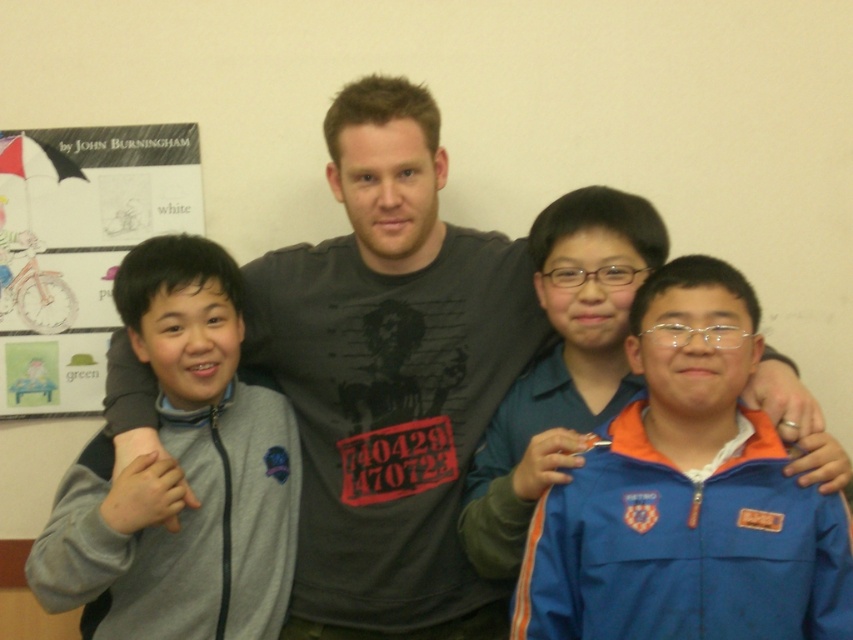
Is gray fleece jacket at left thinner than white paper at upper left?

Indeed, gray fleece jacket at left has a lesser width compared to white paper at upper left.

Find the location of a particular element. The width and height of the screenshot is (853, 640). gray fleece jacket at left is located at coordinates 180,474.

Locate an element on the screen. gray fleece jacket at left is located at coordinates (180, 474).

At what (x,y) coordinates should I click in order to perform the action: click on blue fabric jacket at lower right. Please return your answer as a coordinate pair (x, y). The height and width of the screenshot is (640, 853). Looking at the image, I should click on (688, 496).

Is point (646, 294) closer to viewer compared to point (213, 502)?

Yes, it is in front of point (213, 502).

Identify the location of blue fabric jacket at lower right. (688, 496).

Which is below, matte gray shirt at center or blue fabric jacket at lower right?

blue fabric jacket at lower right

Locate an element on the screen. This screenshot has width=853, height=640. matte gray shirt at center is located at coordinates (390, 376).

You are a GUI agent. You are given a task and a screenshot of the screen. Output one action in this format:
    pyautogui.click(x=<x>, y=<y>)
    Task: Click on the matte gray shirt at center
    
    Given the screenshot: What is the action you would take?
    pyautogui.click(x=390, y=376)

Where is `matte gray shirt at center`? matte gray shirt at center is located at coordinates (390, 376).